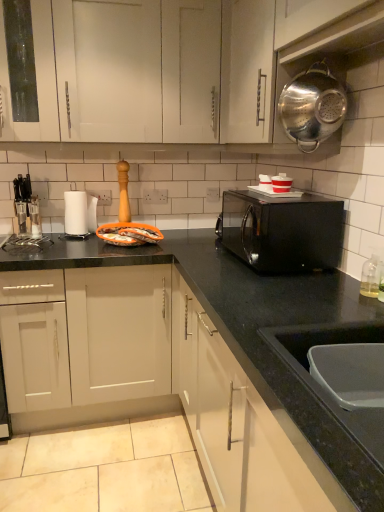
Question: Can you confirm if black glossy microwave at center is shorter than polished stainless steel colander at upper right?

Choices:
 (A) no
 (B) yes

Answer: (A)

Question: Is black glossy microwave at center to the left of polished stainless steel colander at upper right from the viewer's perspective?

Choices:
 (A) no
 (B) yes

Answer: (B)

Question: Does black glossy microwave at center have a greater height compared to polished stainless steel colander at upper right?

Choices:
 (A) no
 (B) yes

Answer: (B)

Question: Is black glossy microwave at center far from polished stainless steel colander at upper right?

Choices:
 (A) yes
 (B) no

Answer: (B)

Question: Is black glossy microwave at center aimed at polished stainless steel colander at upper right?

Choices:
 (A) no
 (B) yes

Answer: (A)

Question: Is white glossy cup at upper center, which is the second appliance from left to right, wider or thinner than metallic silver colander at upper right?

Choices:
 (A) thin
 (B) wide

Answer: (A)

Question: From their relative heights in the image, would you say white glossy cup at upper center, the 2th appliance viewed from the back, is taller or shorter than metallic silver colander at upper right?

Choices:
 (A) short
 (B) tall

Answer: (A)

Question: From the image's perspective, is white glossy cup at upper center, the 2th appliance viewed from the back, positioned above or below metallic silver colander at upper right?

Choices:
 (A) above
 (B) below

Answer: (B)

Question: Is white glossy cup at upper center, the 2th appliance viewed from the back, in front of or behind metallic silver colander at upper right in the image?

Choices:
 (A) behind
 (B) front

Answer: (A)

Question: Is black granite countertop at lower center inside the boundaries of clear glass soap dispenser at right, or outside?

Choices:
 (A) outside
 (B) inside

Answer: (A)

Question: From a real-world perspective, is black granite countertop at lower center above or below clear glass soap dispenser at right?

Choices:
 (A) above
 (B) below

Answer: (B)

Question: Does point (162, 402) appear closer or farther from the camera than point (370, 290)?

Choices:
 (A) closer
 (B) farther

Answer: (B)

Question: From their relative heights in the image, would you say black granite countertop at lower center is taller or shorter than clear glass soap dispenser at right?

Choices:
 (A) tall
 (B) short

Answer: (A)

Question: Would you say matte black knife block at left, the 1th appliance positioned from the back, is to the left or to the right of white glossy cup at upper center, the 2th appliance viewed from the back, in the picture?

Choices:
 (A) right
 (B) left

Answer: (B)

Question: From a real-world perspective, is matte black knife block at left, acting as the 2th appliance starting from the front, above or below white glossy cup at upper center, marked as the first appliance in a right-to-left arrangement?

Choices:
 (A) below
 (B) above

Answer: (A)